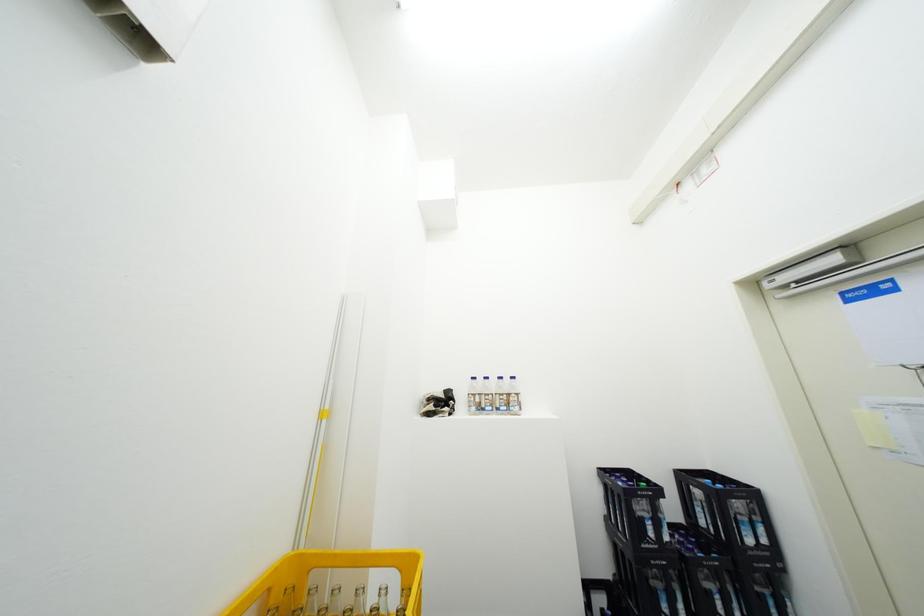
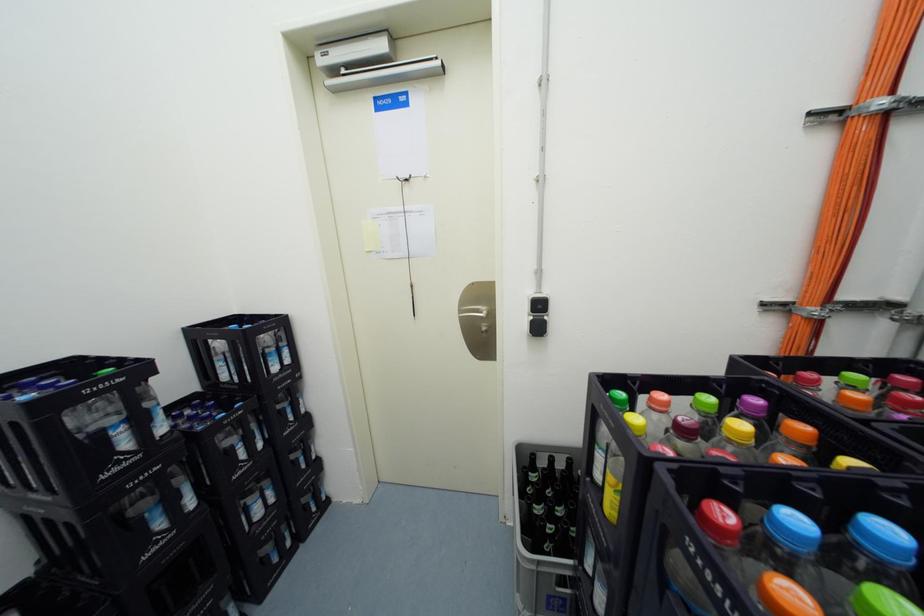
Question: The first image is from the beginning of the video and the second image is from the end. How did the camera likely rotate when shooting the video?

Choices:
 (A) Left
 (B) Right
 (C) Up
 (D) Down

Answer: (B)